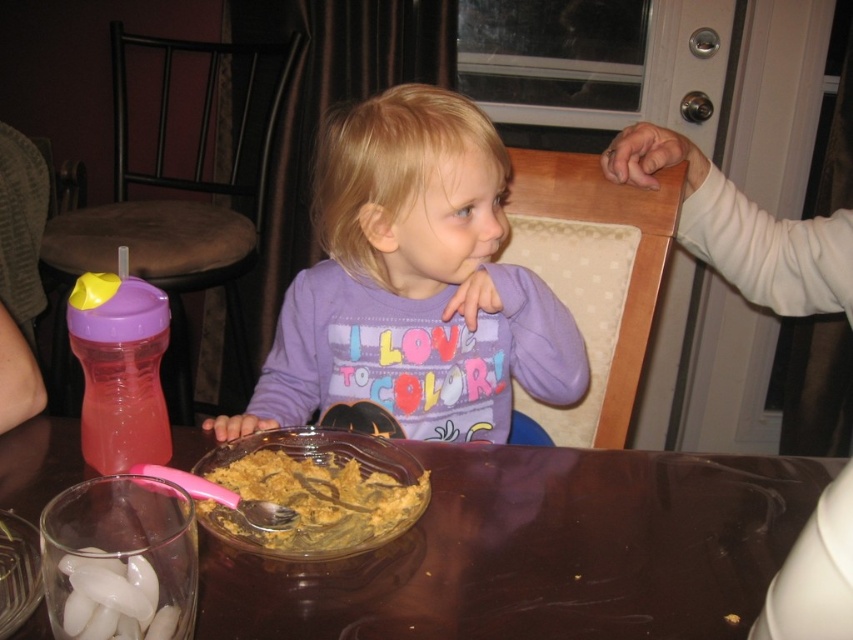
You are a parent trying to locate the transparent glass bowl at center on the table. According to the coordinates provided, where would you find it?

The transparent glass bowl at center is located at coordinates point (540, 552).

You are a parent trying to clean up after your child. You see the transparent glass bowl at center and the brown crumbly food at center. Which one should you pick up first to prevent spills?

The transparent glass bowl at center is below the brown crumbly food at center, so you should pick up the brown crumbly food at center first to prevent it from falling into the bowl.

You are a parent trying to decide which item to give your child first. The brown crumbly food at center and the white rubber teether at lower left are both on the table. Which item has a larger size?

The brown crumbly food at center has a larger width than the white rubber teether at lower left, so it is bigger in size.